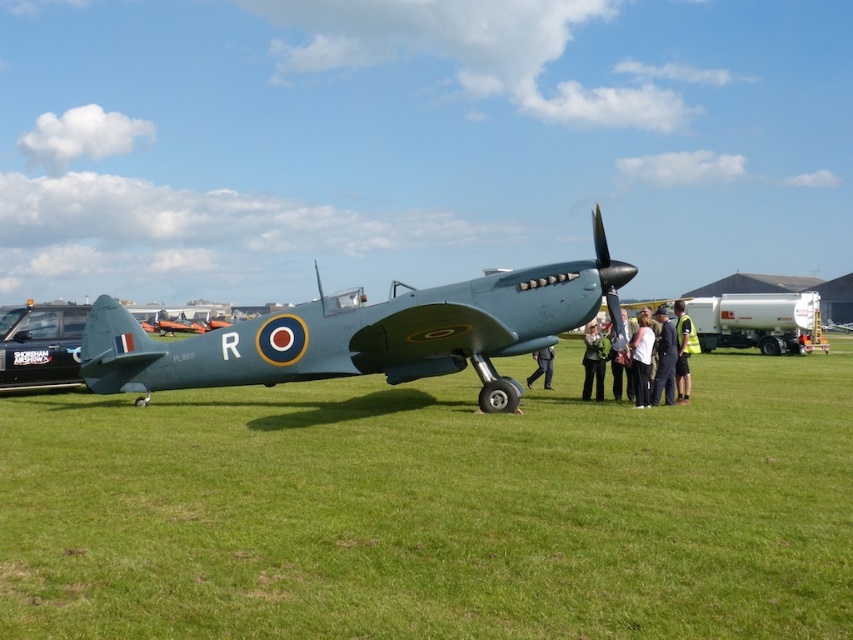
Question: Which point is closer to the camera taking this photo?

Choices:
 (A) (656, 384)
 (B) (270, 440)
 (C) (642, 380)

Answer: (B)

Question: From the image, what is the correct spatial relationship of green grass at center in relation to white fabric jacket at center?

Choices:
 (A) below
 (B) above

Answer: (A)

Question: Does green grass at center lie behind leather jacket at center?

Choices:
 (A) yes
 (B) no

Answer: (B)

Question: Which of the following is the closest to the observer?

Choices:
 (A) yellow reflective vest at center
 (B) matte green jacket at center
 (C) matte green airplane at center
 (D) green grass at center

Answer: (D)

Question: Observing the image, what is the correct spatial positioning of green grass at center in reference to dark blue uniform at center?

Choices:
 (A) above
 (B) below

Answer: (B)

Question: Which point is farther from the camera taking this photo?

Choices:
 (A) (636, 387)
 (B) (612, 348)

Answer: (B)